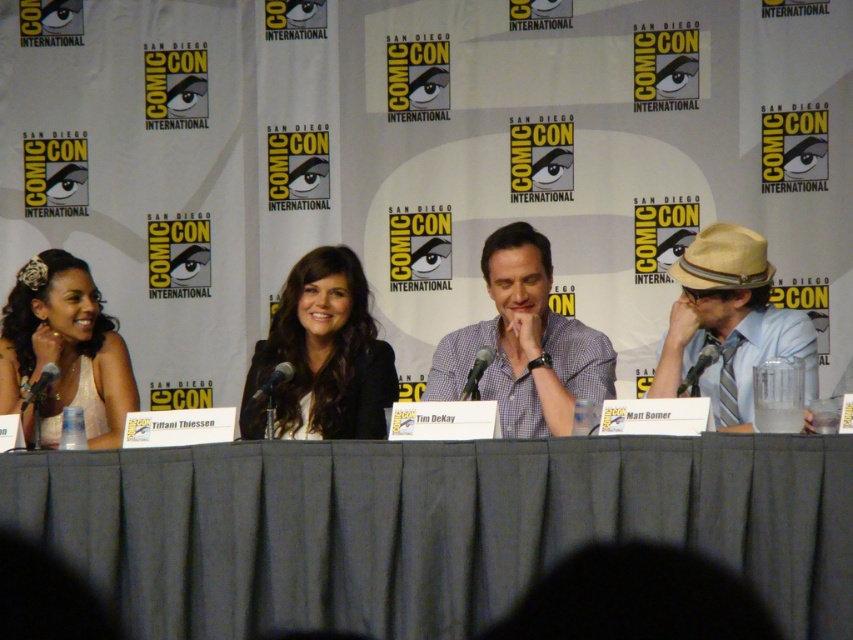
Can you confirm if gray fabric table at center is taller than checkered fabric shirt at center?

Incorrect, gray fabric table at center's height is not larger of checkered fabric shirt at center's.

Consider the image. Who is more forward, (379, 509) or (525, 266)?

Point (379, 509) is in front.

Find the location of a particular element. gray fabric table at center is located at coordinates (427, 525).

Which of these two, checkered fabric shirt at center or white satin dress at left, stands taller?

Standing taller between the two is checkered fabric shirt at center.

Is checkered fabric shirt at center in front of white satin dress at left?

Yes, checkered fabric shirt at center is closer to the viewer.

Between point (444, 336) and point (10, 365), which one is positioned in front?

Positioned in front is point (444, 336).

At what (x,y) coordinates should I click in order to perform the action: click on checkered fabric shirt at center. Please return your answer as a coordinate pair (x, y). Looking at the image, I should click on (525, 342).

Where is `gray fabric table at center`? The width and height of the screenshot is (853, 640). gray fabric table at center is located at coordinates (427, 525).

Describe the element at coordinates (427, 525) in the screenshot. This screenshot has height=640, width=853. I see `gray fabric table at center` at that location.

Find the location of a particular element. gray fabric table at center is located at coordinates (427, 525).

Find the location of a particular element. gray fabric table at center is located at coordinates (427, 525).